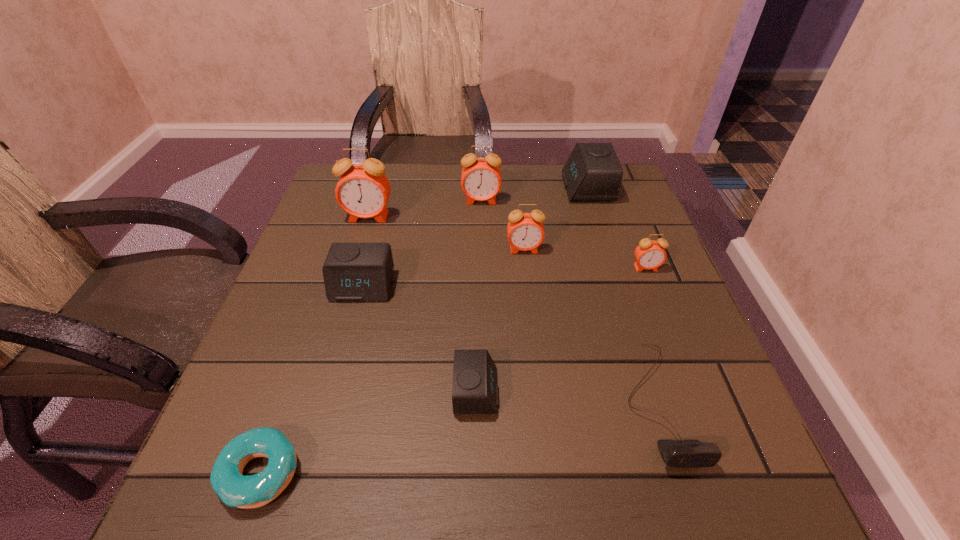
The width and height of the screenshot is (960, 540). I want to click on free spot located on the front-facing side of the biggest black alarm clock, so point(451,188).

Identify the location of vacant point located 0.390m on the front-facing side of the biggest black alarm clock. The height and width of the screenshot is (540, 960). (418, 188).

Image resolution: width=960 pixels, height=540 pixels. I want to click on vacant point located on the face of the nearest pink alarm clock, so click(x=703, y=409).

Identify the location of vacant space positioned 0.390m on the front-facing side of the second nearest black alarm clock. (300, 517).

Locate an element on the screen. This screenshot has width=960, height=540. vacant area located 0.060m on the front-facing side of the smallest black alarm clock is located at coordinates (535, 392).

The height and width of the screenshot is (540, 960). Find the location of `vacant space located on the back of the doughnut`. vacant space located on the back of the doughnut is located at coordinates (333, 267).

Locate an element on the screen. The image size is (960, 540). webcam located in the near edge section of the desktop is located at coordinates (676, 453).

This screenshot has width=960, height=540. I want to click on doughnut at the near edge, so click(234, 489).

At what (x,y) coordinates should I click in order to perform the action: click on doughnut at the left edge. Please return your answer as a coordinate pair (x, y). Looking at the image, I should click on (234, 489).

Identify the location of webcam present at the right edge. The width and height of the screenshot is (960, 540). (676, 453).